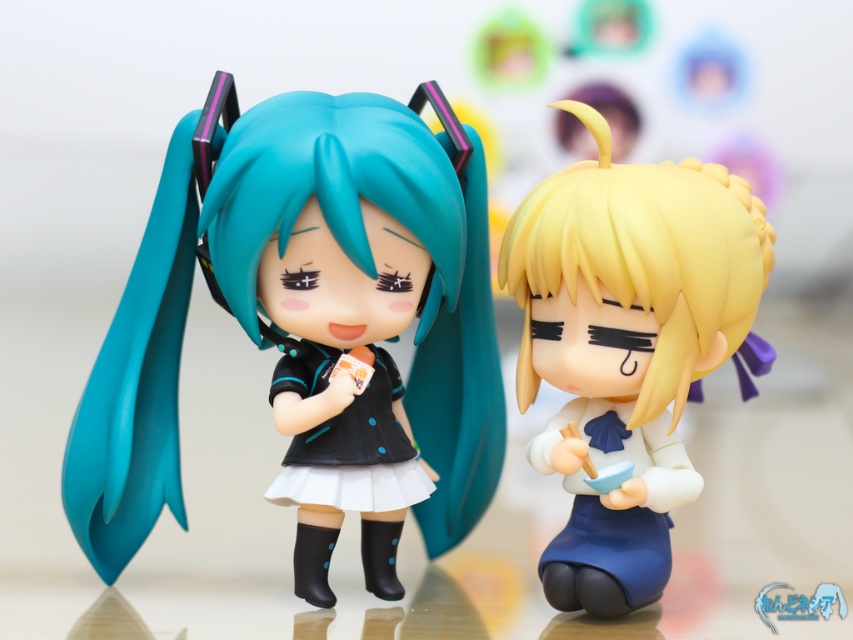
Based on the photo, is matte black figure at left shorter than satin blonde hair at right?

In fact, matte black figure at left may be taller than satin blonde hair at right.

Between point (482, 465) and point (654, 268), which one is positioned behind?

Positioned behind is point (482, 465).

Is point (279, 240) more distant than point (726, 196)?

No, (279, 240) is in front of (726, 196).

You are a GUI agent. You are given a task and a screenshot of the screen. Output one action in this format:
    pyautogui.click(x=<x>, y=<y>)
    Task: Click on the matte black figure at left
    Image resolution: width=853 pixels, height=640 pixels.
    Given the screenshot: What is the action you would take?
    pyautogui.click(x=264, y=310)